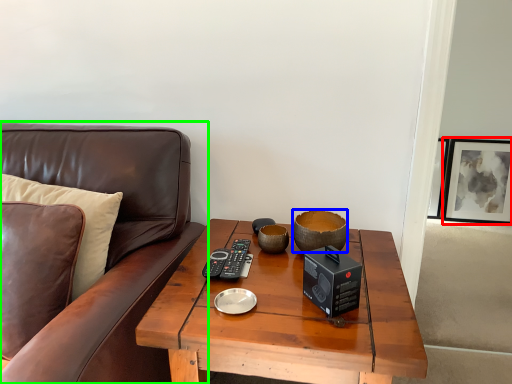
Question: Based on their relative distances, which object is nearer to picture frame (highlighted by a red box)? Choose from bowl (highlighted by a blue box) and studio couch (highlighted by a green box).

Choices:
 (A) bowl
 (B) studio couch

Answer: (A)